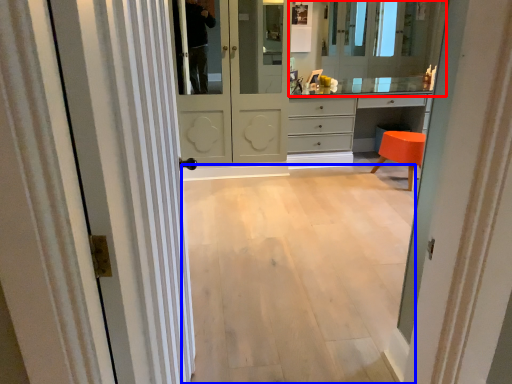
Question: Which point is further to the camera, mirror (highlighted by a red box) or corridor (highlighted by a blue box)?

Choices:
 (A) mirror
 (B) corridor

Answer: (A)